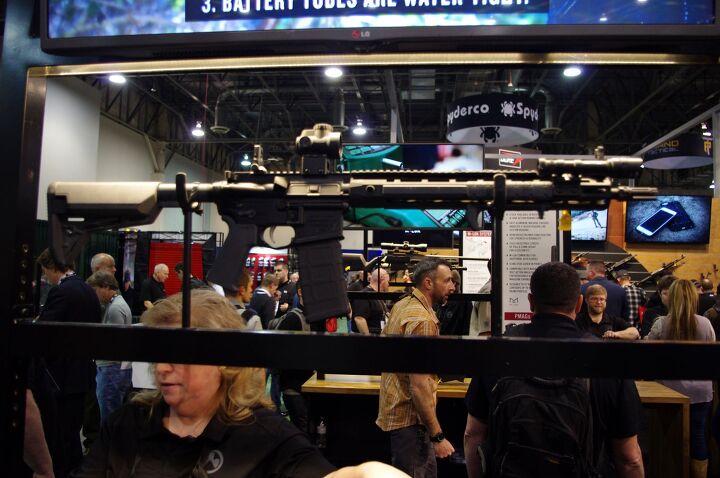
Where is `red curtain`? This screenshot has height=478, width=720. red curtain is located at coordinates (157, 251).